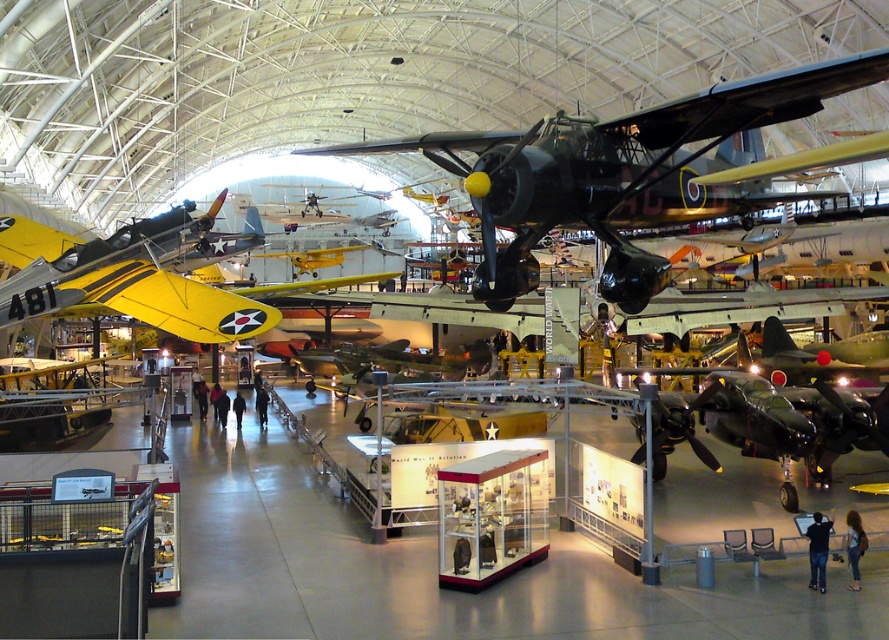
Question: Which of the following is the farthest from the observer?

Choices:
 (A) shiny black airplane at center
 (B) yellow matte airplane at left

Answer: (B)

Question: Can you confirm if shiny black airplane at center is smaller than yellow matte airplane at left?

Choices:
 (A) no
 (B) yes

Answer: (B)

Question: Does shiny black airplane at center appear under yellow matte airplane at left?

Choices:
 (A) yes
 (B) no

Answer: (A)

Question: In this image, where is shiny black airplane at center located relative to yellow matte airplane at left?

Choices:
 (A) left
 (B) right

Answer: (B)

Question: Which point is farther from the camera taking this photo?

Choices:
 (A) (180, 330)
 (B) (637, 179)

Answer: (A)

Question: Which of the following is the farthest from the observer?

Choices:
 (A) (159, 304)
 (B) (630, 202)

Answer: (A)